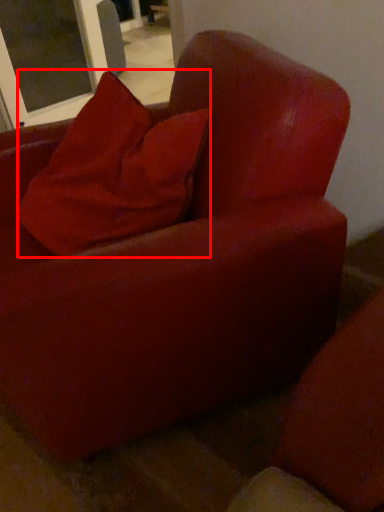
Question: From the image's perspective, where is pillow (annotated by the red box) located in relation to screen door in the image?

Choices:
 (A) above
 (B) below

Answer: (B)